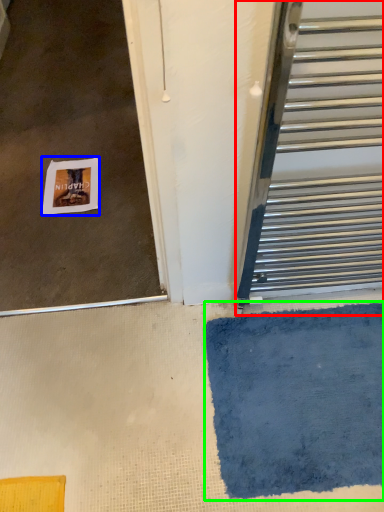
Question: Which object is positioned closest to door (highlighted by a red box)? Select from postcard (highlighted by a blue box) and bath mat (highlighted by a green box).

Choices:
 (A) postcard
 (B) bath mat

Answer: (B)